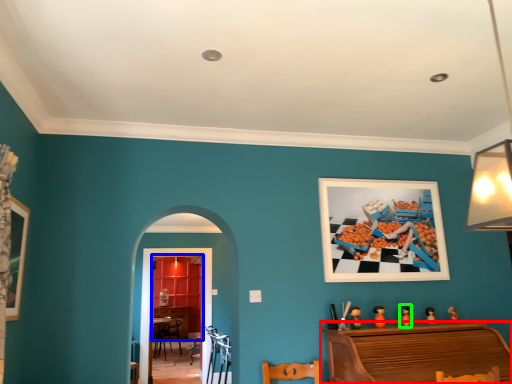
Question: Estimate the real-world distances between objects in this image. Which object is closer to furniture (highlighted by a red box), dresser (highlighted by a blue box) or toy (highlighted by a green box)?

Choices:
 (A) dresser
 (B) toy

Answer: (B)